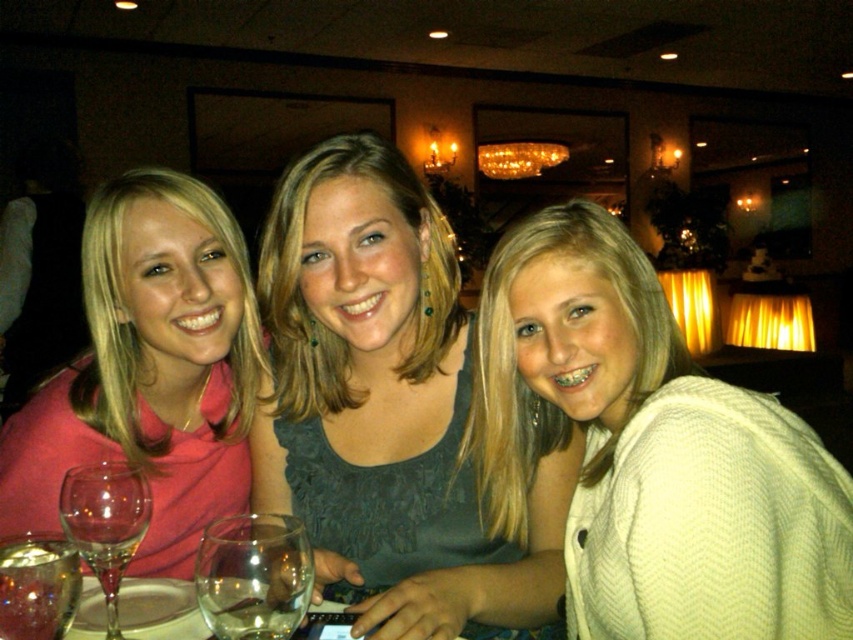
Question: Considering the relative positions of matte pink shirt at left and transparent glass wine glass at lower left in the image provided, where is matte pink shirt at left located with respect to transparent glass wine glass at lower left?

Choices:
 (A) right
 (B) left

Answer: (B)

Question: Estimate the real-world distances between objects in this image. Which object is closer to the dark gray fabric dress at center?

Choices:
 (A) transparent glass at lower left
 (B) clear glass wine glass at lower left

Answer: (B)

Question: Which is nearer to the transparent glass wine at lower center?

Choices:
 (A) clear glass wine at lower left
 (B) matte pink shirt at left

Answer: (A)

Question: Estimate the real-world distances between objects in this image. Which object is closer to the clear glass wine at lower left?

Choices:
 (A) white knitted sweater at center
 (B) matte pink shirt at left
 (C) transparent glass wine glass at lower left
 (D) transparent glass at lower left

Answer: (C)

Question: Does dark gray fabric dress at center have a lesser width compared to transparent glass wine glass at lower left?

Choices:
 (A) yes
 (B) no

Answer: (B)

Question: Is transparent glass at lower left bigger than clear glass wine at lower left?

Choices:
 (A) no
 (B) yes

Answer: (B)